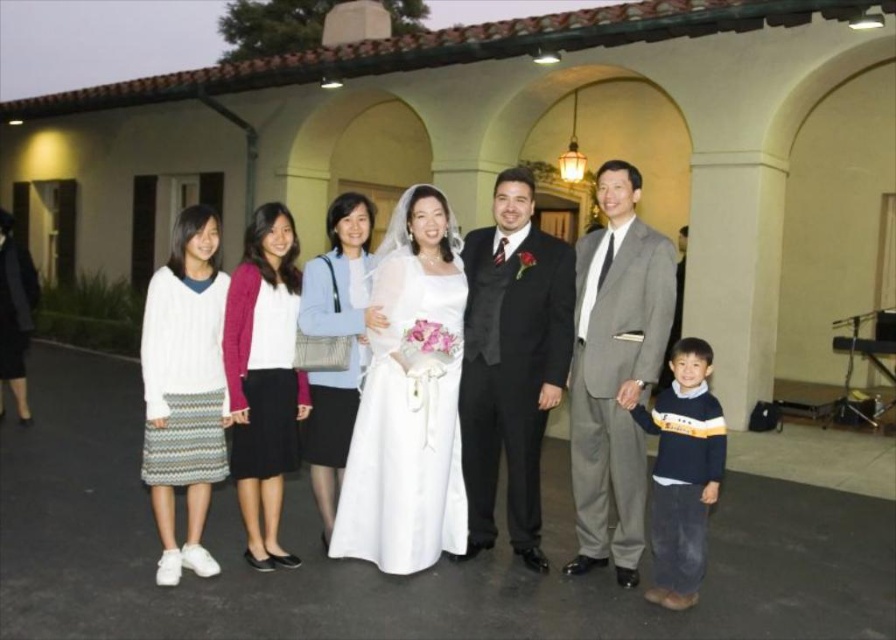
You are a photographer arranging the group for a formal portrait. The bride is wearing the white satin dress at center and the groom is in the shiny black suit at center. To ensure the composition looks balanced, you need to know which one is wider. Which object is wider?

The white satin dress at center is wider than the shiny black suit at center according to the description.

You are a photographer at a wedding. You need to adjust the camera focus so that both the white satin dress at center and the shiny black suit at center are in focus. Which object should you focus on first to ensure proper depth of field?

The white satin dress at center is shorter than the shiny black suit at center, so you should focus on the shiny black suit at center first to ensure proper depth of field.

You are a photographer adjusting the camera settings to ensure all subjects are in focus. The white satin dress at center and the gray suit at right are two key elements. Based on their heights, which one might require you to adjust the focus lower to capture details like the dress embroidery?

The white satin dress at center has a lesser height compared to gray suit at right, so you should adjust the focus lower to capture details like the dress embroidery on the white satin dress at center.